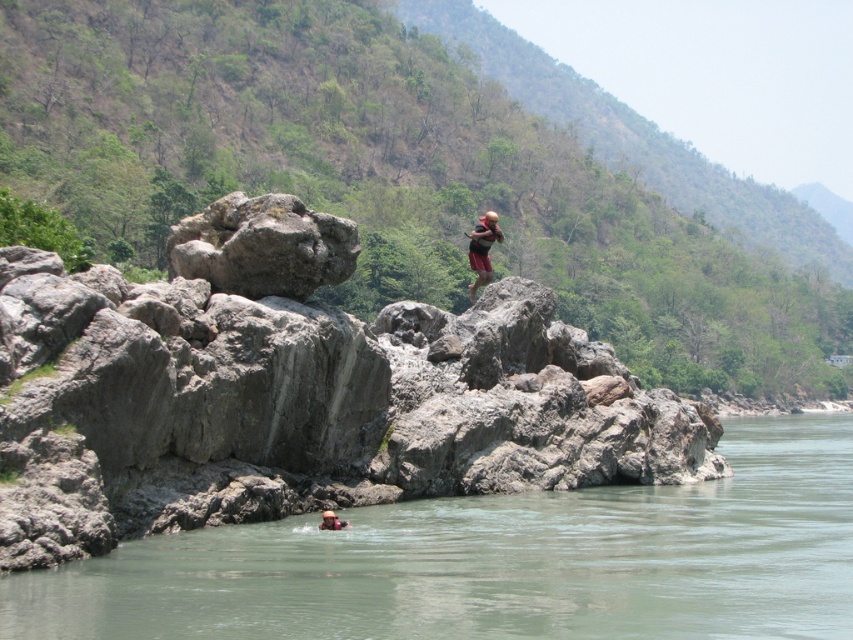
Between greenish-gray water at lower left and tan skin person at upper center, which one is positioned lower?

greenish-gray water at lower left

Between greenish-gray water at lower left and tan skin person at upper center, which one has less height?

greenish-gray water at lower left is shorter.

Which is behind, point (195, 550) or point (486, 248)?

Positioned behind is point (486, 248).

At what (x,y) coordinates should I click in order to perform the action: click on greenish-gray water at lower left. Please return your answer as a coordinate pair (x, y). The width and height of the screenshot is (853, 640). Looking at the image, I should click on (500, 561).

Which is below, gray rough rock at center or brown leather life jacket at lower center?

brown leather life jacket at lower center is below.

Can you confirm if gray rough rock at center is taller than brown leather life jacket at lower center?

Correct, gray rough rock at center is much taller as brown leather life jacket at lower center.

Who is more distant from viewer, (x=500, y=364) or (x=329, y=518)?

The point (x=500, y=364) is more distant.

Where is `gray rough rock at center`? Image resolution: width=853 pixels, height=640 pixels. gray rough rock at center is located at coordinates (294, 392).

Is gray rough rock at center closer to the viewer compared to tan skin person at upper center?

That is True.

Is gray rough rock at center shorter than tan skin person at upper center?

Yes, gray rough rock at center is shorter than tan skin person at upper center.

At what (x,y) coordinates should I click in order to perform the action: click on gray rough rock at center. Please return your answer as a coordinate pair (x, y). This screenshot has height=640, width=853. Looking at the image, I should click on (294, 392).

Where is `gray rough rock at center`? The image size is (853, 640). gray rough rock at center is located at coordinates (294, 392).